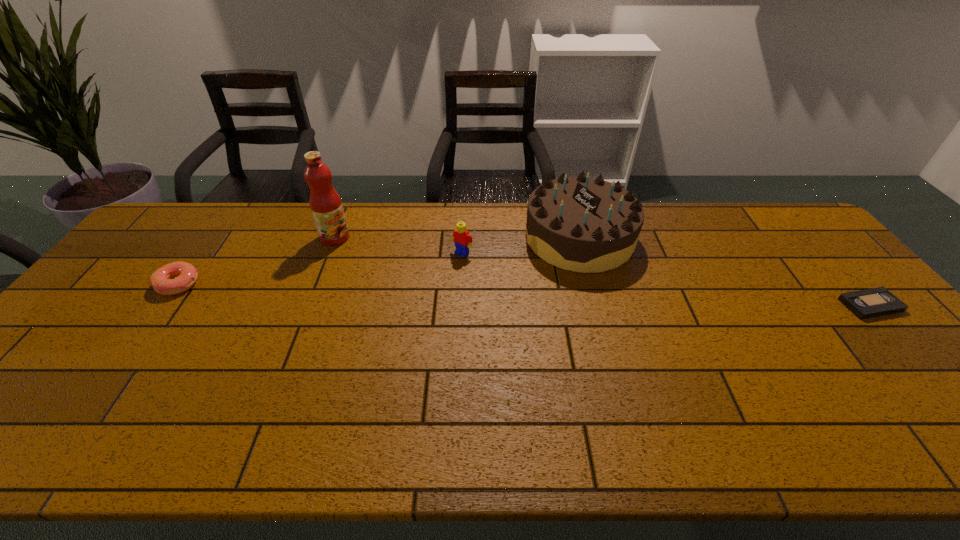
Where is `the closest object to the birthday cake`? The width and height of the screenshot is (960, 540). the closest object to the birthday cake is located at coordinates (462, 239).

At what (x,y) coordinates should I click in order to perform the action: click on vacant position in the image that satisfies the following two spatial constraints: 1. on the back side of the second shortest object; 2. on the right side of the second tallest object. Please return your answer as a coordinate pair (x, y). Image resolution: width=960 pixels, height=540 pixels. Looking at the image, I should click on (211, 238).

Where is `vacant space that satisfies the following two spatial constraints: 1. on the back side of the birthday cake; 2. on the right side of the leftmost object`? The image size is (960, 540). vacant space that satisfies the following two spatial constraints: 1. on the back side of the birthday cake; 2. on the right side of the leftmost object is located at coordinates (211, 238).

Where is `free point that satisfies the following two spatial constraints: 1. on the front side of the second tallest object; 2. on the right side of the shortest object`? This screenshot has height=540, width=960. free point that satisfies the following two spatial constraints: 1. on the front side of the second tallest object; 2. on the right side of the shortest object is located at coordinates (597, 305).

I want to click on free point that satisfies the following two spatial constraints: 1. on the front side of the shortest object; 2. on the left side of the Lego, so click(460, 305).

Find the location of a particular element. This screenshot has height=540, width=960. free space that satisfies the following two spatial constraints: 1. on the front side of the videotape; 2. on the right side of the second tallest object is located at coordinates (597, 305).

What are the coordinates of `free region that satisfies the following two spatial constraints: 1. on the front side of the third tallest object; 2. on the right side of the shortest object` in the screenshot? It's located at click(460, 305).

At what (x,y) coordinates should I click in order to perform the action: click on free point that satisfies the following two spatial constraints: 1. on the back side of the fourth shortest object; 2. on the right side of the second shortest object. Please return your answer as a coordinate pair (x, y). The image size is (960, 540). Looking at the image, I should click on (211, 238).